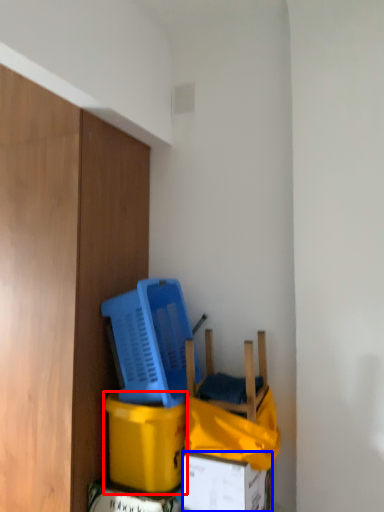
Question: Which object is closer to the camera taking this photo, cardboard box (highlighted by a red box) or box (highlighted by a blue box)?

Choices:
 (A) cardboard box
 (B) box

Answer: (B)